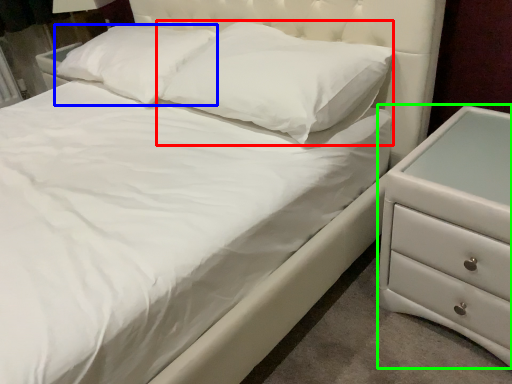
Question: Which object is positioned closest to pillow (highlighted by a red box)? Select from pillow (highlighted by a blue box) and chest of drawers (highlighted by a green box).

Choices:
 (A) pillow
 (B) chest of drawers

Answer: (A)